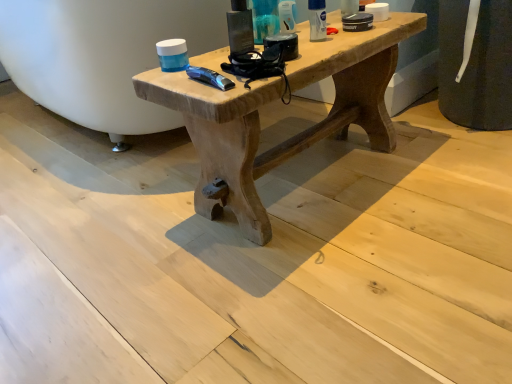
Question: Is natural wood table at center completely or partially outside of translucent plastic tube at upper center, the second toiletry in the right-to-left sequence?

Choices:
 (A) yes
 (B) no

Answer: (A)

Question: Does natural wood table at center lie in front of translucent plastic tube at upper center, the second toiletry in the right-to-left sequence?

Choices:
 (A) yes
 (B) no

Answer: (A)

Question: From the image's perspective, is natural wood table at center located beneath translucent plastic tube at upper center, the second toiletry in the right-to-left sequence?

Choices:
 (A) no
 (B) yes

Answer: (B)

Question: Considering the relative positions of natural wood table at center and translucent plastic tube at upper center, the second toiletry in the right-to-left sequence, in the image provided, is natural wood table at center to the right of translucent plastic tube at upper center, the second toiletry in the right-to-left sequence, from the viewer's perspective?

Choices:
 (A) no
 (B) yes

Answer: (B)

Question: Is natural wood table at center not close to translucent plastic tube at upper center, the second toiletry in the right-to-left sequence?

Choices:
 (A) no
 (B) yes

Answer: (A)

Question: Is translucent plastic tube at upper center, the second toiletry in the right-to-left sequence, inside the boundaries of natural wood table at center, or outside?

Choices:
 (A) inside
 (B) outside

Answer: (B)

Question: Is translucent plastic tube at upper center, the second toiletry in the right-to-left sequence, to the left or to the right of natural wood table at center in the image?

Choices:
 (A) right
 (B) left

Answer: (B)

Question: Considering the positions of translucent plastic tube at upper center, the second toiletry viewed from the left, and natural wood table at center in the image, is translucent plastic tube at upper center, the second toiletry viewed from the left, wider or thinner than natural wood table at center?

Choices:
 (A) thin
 (B) wide

Answer: (A)

Question: Considering their positions, is translucent plastic tube at upper center, the second toiletry viewed from the left, located in front of or behind natural wood table at center?

Choices:
 (A) front
 (B) behind

Answer: (B)

Question: Is white matte deodorant at upper right, the first toiletry from the right, taller or shorter than natural wood table at center?

Choices:
 (A) short
 (B) tall

Answer: (A)

Question: From the image's perspective, is white matte deodorant at upper right, the first toiletry from the right, located above or below natural wood table at center?

Choices:
 (A) above
 (B) below

Answer: (A)

Question: In terms of width, does white matte deodorant at upper right, the first toiletry from the right, look wider or thinner when compared to natural wood table at center?

Choices:
 (A) thin
 (B) wide

Answer: (A)

Question: Is white matte deodorant at upper right, the first toiletry from the right, spatially inside natural wood table at center, or outside of it?

Choices:
 (A) inside
 (B) outside

Answer: (B)

Question: Considering their positions, is white matte deodorant at upper right, positioned as the third toiletry in left-to-right order, located in front of or behind matte plastic container at upper center, the 1th toiletry viewed from the left?

Choices:
 (A) front
 (B) behind

Answer: (B)

Question: Is white matte deodorant at upper right, positioned as the third toiletry in left-to-right order, to the left or to the right of matte plastic container at upper center, placed as the 3th toiletry when sorted from right to left, in the image?

Choices:
 (A) right
 (B) left

Answer: (A)